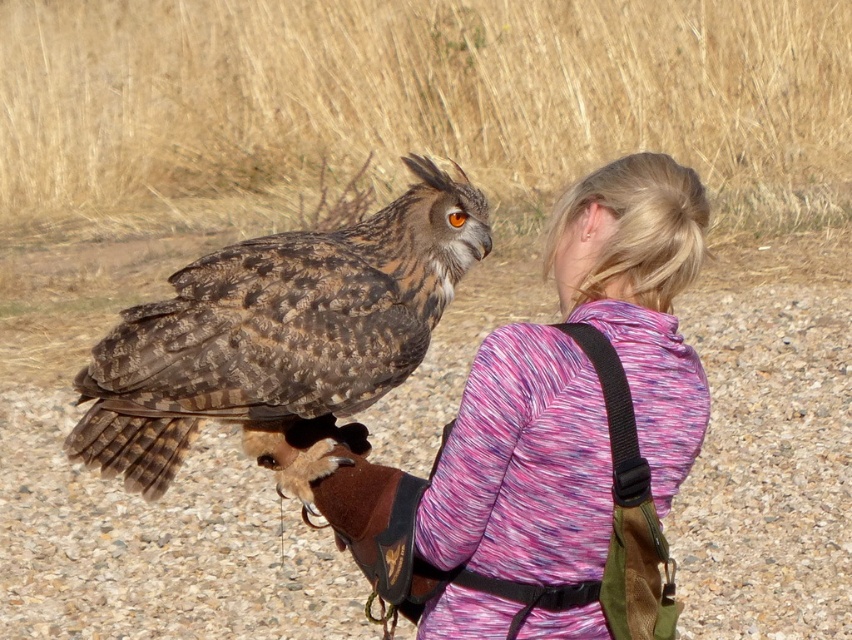
Is multicolored fleece at center below brown speckled owl at center?

Yes, multicolored fleece at center is below brown speckled owl at center.

Between point (626, 172) and point (251, 314), which one is positioned behind?

Positioned behind is point (251, 314).

You are a GUI agent. You are given a task and a screenshot of the screen. Output one action in this format:
    pyautogui.click(x=<x>, y=<y>)
    Task: Click on the multicolored fleece at center
    The image size is (852, 640).
    Given the screenshot: What is the action you would take?
    pyautogui.click(x=551, y=440)

Which of these two, brown textured glove at center or brown speckled owl at center, stands taller?

brown speckled owl at center is taller.

Is brown textured glove at center thinner than brown speckled owl at center?

In fact, brown textured glove at center might be wider than brown speckled owl at center.

Who is more forward, (715, 515) or (442, 266)?

Point (442, 266) is more forward.

This screenshot has height=640, width=852. I want to click on brown textured glove at center, so click(154, 545).

Can you confirm if brown textured glove at center is wider than multicolored fleece at center?

Yes.

Which is behind, point (32, 580) or point (338, 532)?

The point (32, 580) is more distant.

Identify the location of brown textured glove at center. (154, 545).